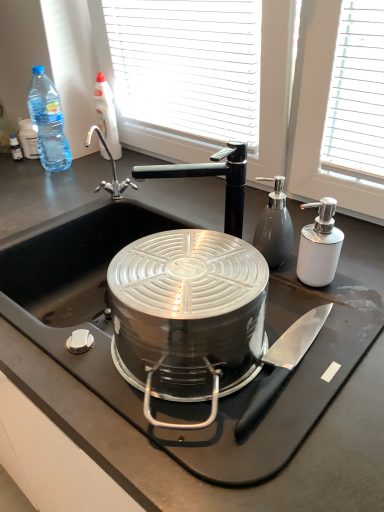
Where is `empty space that is in between white glossy soap dispenser at right and polished stainless steel knife at lower center`? empty space that is in between white glossy soap dispenser at right and polished stainless steel knife at lower center is located at coordinates (289, 318).